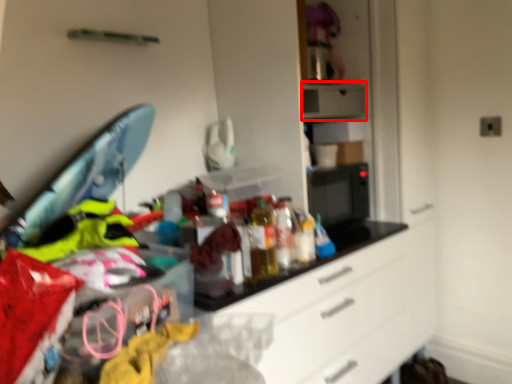
Question: From the image, what is the correct spatial relationship of appliance (annotated by the red box) in relation to bottle?

Choices:
 (A) left
 (B) right

Answer: (B)